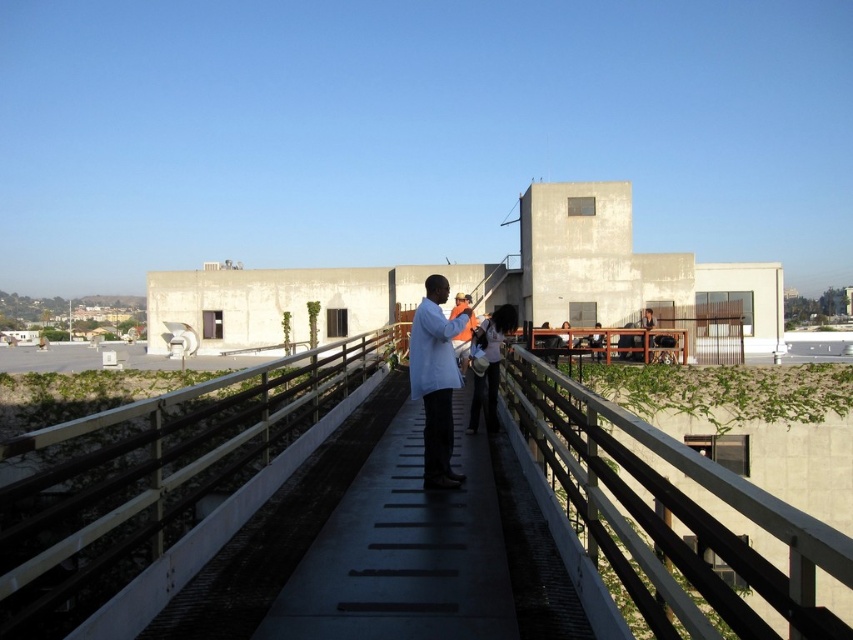
Question: Among these points, which one is nearest to the camera?

Choices:
 (A) (660, 522)
 (B) (155, 480)
 (C) (433, 422)
 (D) (474, 410)

Answer: (A)

Question: Which point is farther from the camera taking this photo?

Choices:
 (A) (x=462, y=332)
 (B) (x=653, y=586)

Answer: (B)

Question: Does metallic gray rail at center have a larger size compared to white matte coat at center?

Choices:
 (A) yes
 (B) no

Answer: (A)

Question: Is white fabric bag at center smaller than white matte coat at center?

Choices:
 (A) yes
 (B) no

Answer: (B)

Question: Which of these objects is positioned farthest from the white fabric bag at center?

Choices:
 (A) brown wooden rail at center
 (B) metallic gray rail at center

Answer: (B)

Question: Is brown wooden rail at center smaller than white fabric bag at center?

Choices:
 (A) no
 (B) yes

Answer: (A)